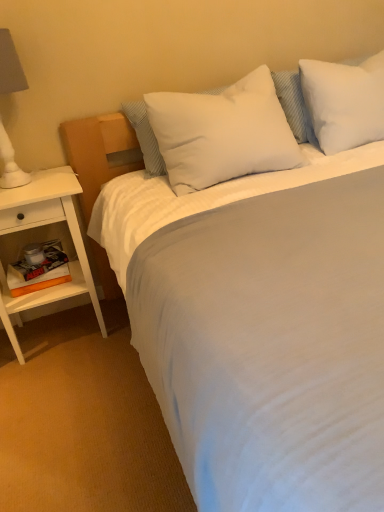
What are the coordinates of `free space above white wood nightstand at left (from a real-world perspective)` in the screenshot? It's located at tap(37, 179).